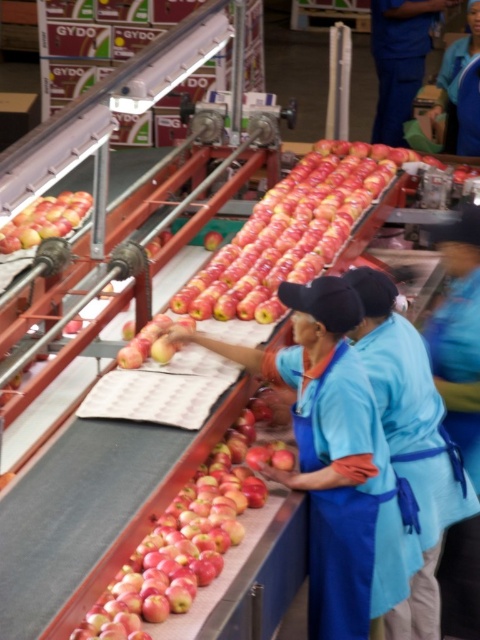
Is matte blue apron at center smaller than glossy red apple at center?

Actually, matte blue apron at center might be larger than glossy red apple at center.

Does matte blue apron at center appear over glossy red apple at center?

Yes, matte blue apron at center is above glossy red apple at center.

The image size is (480, 640). What do you see at coordinates (334, 460) in the screenshot?
I see `matte blue apron at center` at bounding box center [334, 460].

Locate an element on the screen. The height and width of the screenshot is (640, 480). matte blue apron at center is located at coordinates (334, 460).

Which of these two, matte blue apron at center or shiny red apple at left, stands shorter?

shiny red apple at left is shorter.

Does point (311, 308) come farther from viewer compared to point (68, 228)?

That is False.

Find the location of a particular element. This screenshot has width=480, height=640. matte blue apron at center is located at coordinates (334, 460).

You are a GUI agent. You are given a task and a screenshot of the screen. Output one action in this format:
    pyautogui.click(x=<x>, y=<y>)
    Task: Click on the blue fabric apron at center
    The height and width of the screenshot is (640, 480).
    Given the screenshot: What is the action you would take?
    pyautogui.click(x=351, y=502)

Who is higher up, blue fabric apron at center or shiny red apple at left?

shiny red apple at left is above.

You are a GUI agent. You are given a task and a screenshot of the screen. Output one action in this format:
    pyautogui.click(x=<x>, y=<y>)
    Task: Click on the blue fabric apron at center
    
    Given the screenshot: What is the action you would take?
    pyautogui.click(x=351, y=502)